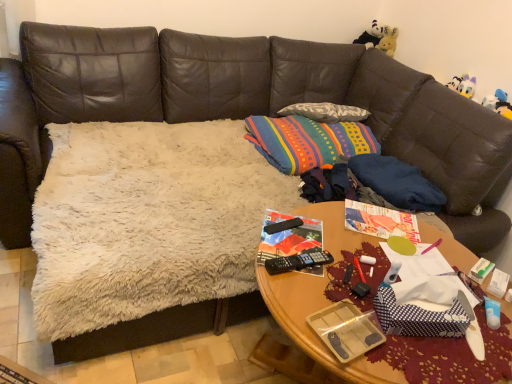
The width and height of the screenshot is (512, 384). Find the location of `vacant area on the back side of clear plastic tray at center`. vacant area on the back side of clear plastic tray at center is located at coordinates (328, 294).